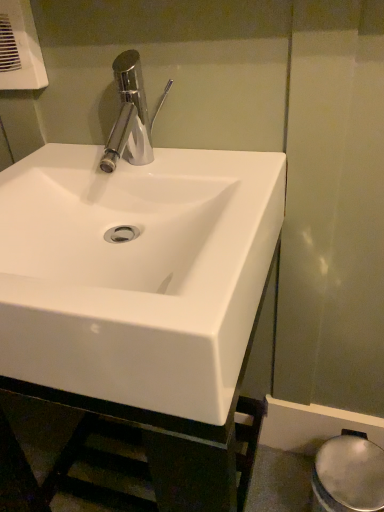
Question: Does white glossy bidet at lower right come in front of white glossy sink at center?

Choices:
 (A) no
 (B) yes

Answer: (A)

Question: From the image's perspective, does white glossy bidet at lower right appear lower than white glossy sink at center?

Choices:
 (A) no
 (B) yes

Answer: (B)

Question: Is white glossy bidet at lower right wider than white glossy sink at center?

Choices:
 (A) yes
 (B) no

Answer: (B)

Question: Does white glossy bidet at lower right have a lesser width compared to white glossy sink at center?

Choices:
 (A) yes
 (B) no

Answer: (A)

Question: Is the surface of white glossy bidet at lower right in direct contact with white glossy sink at center?

Choices:
 (A) yes
 (B) no

Answer: (B)

Question: From a real-world perspective, is white glossy bidet at lower right under white glossy sink at center?

Choices:
 (A) yes
 (B) no

Answer: (A)

Question: Can you confirm if white glossy sink at center is thinner than white plastic hand dryer at upper left?

Choices:
 (A) no
 (B) yes

Answer: (A)

Question: Is there a large distance between white glossy sink at center and white plastic hand dryer at upper left?

Choices:
 (A) yes
 (B) no

Answer: (B)

Question: Can you confirm if white glossy sink at center is positioned to the left of white plastic hand dryer at upper left?

Choices:
 (A) no
 (B) yes

Answer: (A)

Question: Is white glossy sink at center completely or partially outside of white plastic hand dryer at upper left?

Choices:
 (A) no
 (B) yes

Answer: (B)

Question: Could white plastic hand dryer at upper left be considered to be inside white glossy sink at center?

Choices:
 (A) no
 (B) yes

Answer: (A)

Question: Can you confirm if white glossy sink at center is wider than white plastic hand dryer at upper left?

Choices:
 (A) no
 (B) yes

Answer: (B)

Question: From a real-world perspective, is white plastic hand dryer at upper left located higher than white glossy sink at center?

Choices:
 (A) no
 (B) yes

Answer: (B)